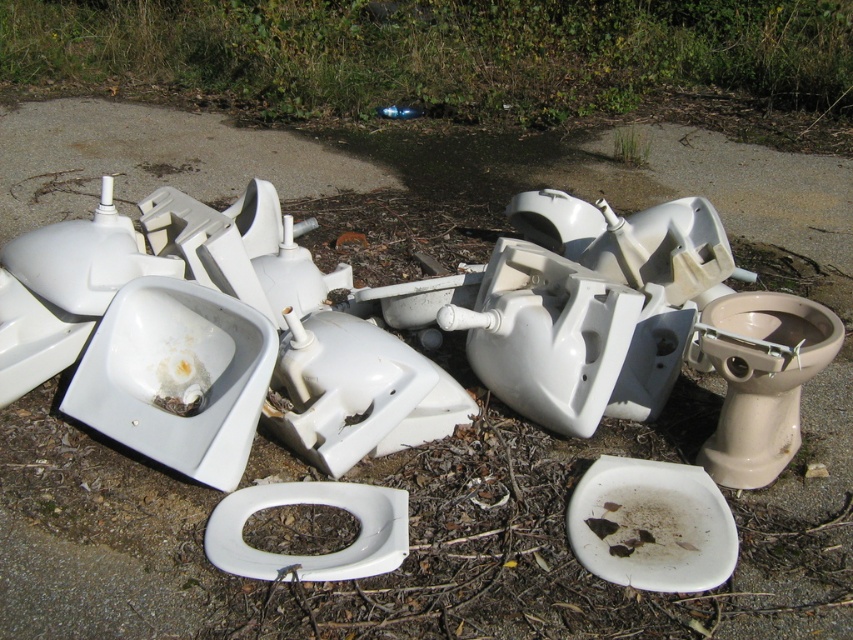
In the scene shown: Which of these two, beige ceramic toilet bowl at center-right or white matte toilet bowl at center, stands shorter?

white matte toilet bowl at center

Is beige ceramic toilet bowl at center-right to the left of white matte toilet bowl at center from the viewer's perspective?

In fact, beige ceramic toilet bowl at center-right is to the right of white matte toilet bowl at center.

Does point (769, 394) come in front of point (727, 516)?

No, it is not.

I want to click on beige ceramic toilet bowl at center-right, so click(x=761, y=378).

Is point (654, 465) less distant than point (334, 500)?

No, (654, 465) is behind (334, 500).

Find the location of a particular element. The width and height of the screenshot is (853, 640). white matte toilet bowl at center is located at coordinates (651, 525).

Who is higher up, beige ceramic toilet bowl at center-right or white glossy toilet bowl at center?

beige ceramic toilet bowl at center-right is higher up.

Where is `beige ceramic toilet bowl at center-right`? The height and width of the screenshot is (640, 853). beige ceramic toilet bowl at center-right is located at coordinates (761, 378).

Between point (770, 385) and point (248, 513), which one is positioned behind?

The point (770, 385) is more distant.

You are a GUI agent. You are given a task and a screenshot of the screen. Output one action in this format:
    pyautogui.click(x=<x>, y=<y>)
    Task: Click on the beige ceramic toilet bowl at center-right
    The width and height of the screenshot is (853, 640).
    Given the screenshot: What is the action you would take?
    pyautogui.click(x=761, y=378)